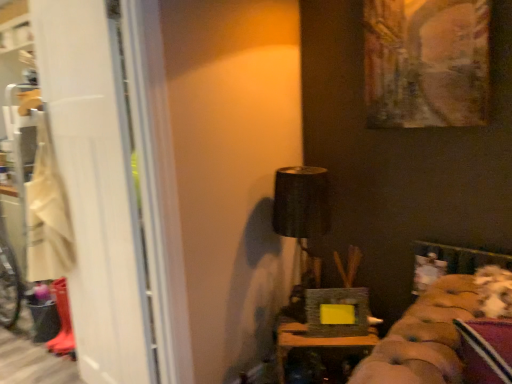
What do you see at coordinates (301, 202) in the screenshot? I see `black fabric lampshade at upper center` at bounding box center [301, 202].

Based on the photo, what is the approximate width of matte black picture frame at center, positioned as the 1th picture frame in bottom-to-top order?

It is 2.09 inches.

The height and width of the screenshot is (384, 512). Find the location of `wooden textured box at center`. wooden textured box at center is located at coordinates (313, 342).

What do you see at coordinates (313, 342) in the screenshot? The image size is (512, 384). I see `wooden textured box at center` at bounding box center [313, 342].

You are a GUI agent. You are given a task and a screenshot of the screen. Output one action in this format:
    pyautogui.click(x=<x>, y=<y>)
    Task: Click on the white matte screen door at left
    
    Given the screenshot: What is the action you would take?
    pyautogui.click(x=99, y=184)

From a real-world perspective, which is physically above, oil painting at upper right, which ranks as the 1th picture frame in right-to-left order, or black fabric lampshade at upper center?

oil painting at upper right, which ranks as the 1th picture frame in right-to-left order, from a real-world perspective.

Which is correct: oil painting at upper right, arranged as the second picture frame when ordered from the bottom, is inside black fabric lampshade at upper center, or outside of it?

oil painting at upper right, arranged as the second picture frame when ordered from the bottom, lies outside black fabric lampshade at upper center.

Is point (469, 60) closer to camera compared to point (326, 218)?

Yes, it is.

Is oil painting at upper right, which ranks as the 1th picture frame in right-to-left order, shorter than black fabric lampshade at upper center?

Correct, oil painting at upper right, which ranks as the 1th picture frame in right-to-left order, is not as tall as black fabric lampshade at upper center.

I want to click on furniture below the oil painting at upper right, which ranks as the 1th picture frame in right-to-left order (from a real-world perspective), so click(313, 342).

Is wooden textured box at center to the left or to the right of oil painting at upper right, which ranks as the 1th picture frame in right-to-left order, in the image?

wooden textured box at center is to the left of oil painting at upper right, which ranks as the 1th picture frame in right-to-left order.

From the picture: From the image's perspective, relative to oil painting at upper right, which ranks as the 1th picture frame in right-to-left order, is wooden textured box at center above or below?

wooden textured box at center is below oil painting at upper right, which ranks as the 1th picture frame in right-to-left order.

In terms of height, does wooden textured box at center look taller or shorter compared to oil painting at upper right, arranged as the second picture frame when ordered from the bottom?

Clearly, wooden textured box at center is shorter compared to oil painting at upper right, arranged as the second picture frame when ordered from the bottom.

Is oil painting at upper right, which ranks as the 1th picture frame in right-to-left order, aimed at wooden textured box at center?

A: No, oil painting at upper right, which ranks as the 1th picture frame in right-to-left order, is not aimed at wooden textured box at center.

Is oil painting at upper right, the 1th picture frame in the top-to-bottom sequence, smaller than wooden textured box at center?

Correct, oil painting at upper right, the 1th picture frame in the top-to-bottom sequence, occupies less space than wooden textured box at center.

Between point (455, 44) and point (279, 352), which one is positioned in front?

The point (455, 44) is more forward.

From the picture: Is oil painting at upper right, which ranks as the 1th picture frame in right-to-left order, in front of or behind wooden textured box at center in the image?

oil painting at upper right, which ranks as the 1th picture frame in right-to-left order, is in front of wooden textured box at center.

From a real-world perspective, is white matte screen door at left below oil painting at upper right, which ranks as the 1th picture frame in right-to-left order?

Yes.

Is white matte screen door at left in contact with oil painting at upper right, which ranks as the 1th picture frame in right-to-left order?

They are not placed beside each other.

From the picture: How far apart are white matte screen door at left and oil painting at upper right, which ranks as the 1th picture frame in right-to-left order?

white matte screen door at left and oil painting at upper right, which ranks as the 1th picture frame in right-to-left order, are 3.90 feet apart from each other.

This screenshot has width=512, height=384. What are the coordinates of `picture frame lying above the white matte screen door at left (from the image's perspective)` in the screenshot? It's located at (426, 62).

Looking at the image, does oil painting at upper right, the 1th picture frame in the top-to-bottom sequence, seem bigger or smaller compared to matte black picture frame at center, positioned as the 1th picture frame in bottom-to-top order?

oil painting at upper right, the 1th picture frame in the top-to-bottom sequence, is bigger than matte black picture frame at center, positioned as the 1th picture frame in bottom-to-top order.

Considering the sizes of oil painting at upper right, which ranks as the 1th picture frame in right-to-left order, and matte black picture frame at center, which is the second picture frame from right to left, in the image, is oil painting at upper right, which ranks as the 1th picture frame in right-to-left order, taller or shorter than matte black picture frame at center, which is the second picture frame from right to left,?

oil painting at upper right, which ranks as the 1th picture frame in right-to-left order, is taller than matte black picture frame at center, which is the second picture frame from right to left.

Consider the image. Is matte black picture frame at center, which is the first picture frame in left-to-right order, inside oil painting at upper right, which ranks as the 2th picture frame in left-to-right order?

No.

Which of these two, wooden textured box at center or black fabric lampshade at upper center, stands taller?

Standing taller between the two is black fabric lampshade at upper center.

Does wooden textured box at center come behind black fabric lampshade at upper center?

No, the depth of wooden textured box at center is less than that of black fabric lampshade at upper center.

Considering the relative positions of wooden textured box at center and black fabric lampshade at upper center in the image provided, is wooden textured box at center to the left of black fabric lampshade at upper center from the viewer's perspective?

In fact, wooden textured box at center is to the right of black fabric lampshade at upper center.

Could you tell me if wooden textured box at center is facing black fabric lampshade at upper center?

No, wooden textured box at center is not oriented towards black fabric lampshade at upper center.

Is beige fabric laundry at left at the back of wooden textured box at center?

No, wooden textured box at center's orientation is not away from beige fabric laundry at left.

From the image's perspective, would you say wooden textured box at center is positioned over beige fabric laundry at left?

Incorrect, from the image's perspective, wooden textured box at center is lower than beige fabric laundry at left.

Which is closer to the camera, (281, 336) or (40, 246)?

Point (281, 336) is closer to the camera than point (40, 246).

The width and height of the screenshot is (512, 384). Identify the location of lamp below the oil painting at upper right, arranged as the second picture frame when ordered from the bottom (from the image's perspective). (301, 202).

Locate an element on the screen. furniture lying on the left of oil painting at upper right, which ranks as the 2th picture frame in left-to-right order is located at coordinates (313, 342).

Looking at this image, from the image, which object appears to be nearer to oil painting at upper right, the 1th picture frame in the top-to-bottom sequence, black fabric lampshade at upper center or white matte screen door at left?

black fabric lampshade at upper center is positioned closer to the anchor oil painting at upper right, the 1th picture frame in the top-to-bottom sequence.

When comparing their distances from white matte screen door at left, does wooden textured box at center or oil painting at upper right, which ranks as the 2th picture frame in left-to-right order, seem further?

Based on the image, oil painting at upper right, which ranks as the 2th picture frame in left-to-right order, appears to be further to white matte screen door at left.

Based on their spatial positions, is matte black picture frame at center, acting as the second picture frame starting from the top, or white matte screen door at left closer to beige fabric laundry at left?

white matte screen door at left lies closer to beige fabric laundry at left than the other object.

Based on their spatial positions, is black fabric lampshade at upper center or oil painting at upper right, the 1th picture frame in the top-to-bottom sequence, further from matte black picture frame at center, which is the second picture frame from right to left?

oil painting at upper right, the 1th picture frame in the top-to-bottom sequence, lies further to matte black picture frame at center, which is the second picture frame from right to left, than the other object.

Which object lies further to the anchor point white matte screen door at left, wooden textured box at center or black fabric lampshade at upper center?

wooden textured box at center is positioned further to the anchor white matte screen door at left.

From the image, which object appears to be nearer to beige fabric laundry at left, black fabric lampshade at upper center or oil painting at upper right, the 1th picture frame in the top-to-bottom sequence?

black fabric lampshade at upper center is closer to beige fabric laundry at left.

Estimate the real-world distances between objects in this image. Which object is closer to wooden textured box at center, oil painting at upper right, the 1th picture frame in the top-to-bottom sequence, or matte black picture frame at center, which is the first picture frame in left-to-right order?

The object closer to wooden textured box at center is matte black picture frame at center, which is the first picture frame in left-to-right order.

Which object lies nearer to the anchor point oil painting at upper right, arranged as the second picture frame when ordered from the bottom, black fabric lampshade at upper center or wooden textured box at center?

black fabric lampshade at upper center is closer to oil painting at upper right, arranged as the second picture frame when ordered from the bottom.

Where is `lamp between oil painting at upper right, the 1th picture frame in the top-to-bottom sequence, and wooden textured box at center vertically`? lamp between oil painting at upper right, the 1th picture frame in the top-to-bottom sequence, and wooden textured box at center vertically is located at coordinates click(x=301, y=202).

The image size is (512, 384). Find the location of `picture frame between oil painting at upper right, arranged as the second picture frame when ordered from the bottom, and wooden textured box at center vertically`. picture frame between oil painting at upper right, arranged as the second picture frame when ordered from the bottom, and wooden textured box at center vertically is located at coordinates (337, 312).

Locate an element on the screen. The image size is (512, 384). picture frame between black fabric lampshade at upper center and wooden textured box at center in the vertical direction is located at coordinates (337, 312).

Locate an element on the screen. The image size is (512, 384). lamp situated between white matte screen door at left and matte black picture frame at center, which is the first picture frame in left-to-right order, from left to right is located at coordinates (301, 202).